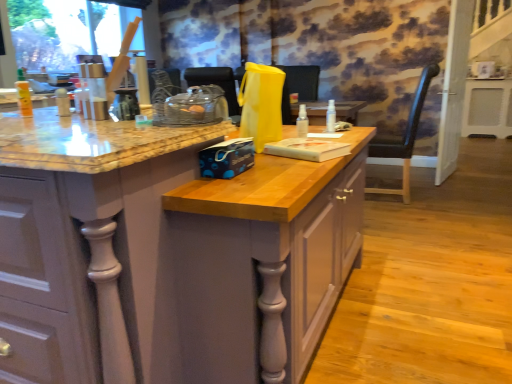
Question: From a real-world perspective, is white glossy screen door at right positioned under black leather chair at right based on gravity?

Choices:
 (A) no
 (B) yes

Answer: (A)

Question: Is white glossy screen door at right in contact with black leather chair at right?

Choices:
 (A) yes
 (B) no

Answer: (B)

Question: Is white glossy screen door at right outside of black leather chair at right?

Choices:
 (A) no
 (B) yes

Answer: (B)

Question: From a real-world perspective, is white glossy screen door at right on top of black leather chair at right?

Choices:
 (A) yes
 (B) no

Answer: (A)

Question: Does white glossy screen door at right appear on the left side of black leather chair at right?

Choices:
 (A) no
 (B) yes

Answer: (A)

Question: Considering the positions of transparent plastic spray bottle at center, positioned as the first bottle in back-to-front order, and black leather chair at right in the image, is transparent plastic spray bottle at center, positioned as the first bottle in back-to-front order, wider or thinner than black leather chair at right?

Choices:
 (A) wide
 (B) thin

Answer: (B)

Question: Considering the positions of transparent plastic spray bottle at center, which appears as the second bottle when viewed from the front, and black leather chair at right in the image, is transparent plastic spray bottle at center, which appears as the second bottle when viewed from the front, bigger or smaller than black leather chair at right?

Choices:
 (A) small
 (B) big

Answer: (A)

Question: In terms of height, does transparent plastic spray bottle at center, arranged as the second bottle when viewed from the left, look taller or shorter compared to black leather chair at right?

Choices:
 (A) short
 (B) tall

Answer: (A)

Question: From a real-world perspective, is transparent plastic spray bottle at center, arranged as the second bottle when viewed from the left, above or below black leather chair at right?

Choices:
 (A) above
 (B) below

Answer: (A)

Question: Considering the positions of transparent plastic spray bottle at center, which appears as the second bottle when viewed from the front, and matte wood cabinet at center in the image, is transparent plastic spray bottle at center, which appears as the second bottle when viewed from the front, bigger or smaller than matte wood cabinet at center?

Choices:
 (A) small
 (B) big

Answer: (A)

Question: Is transparent plastic spray bottle at center, the 1th bottle positioned from the right, in front of or behind matte wood cabinet at center in the image?

Choices:
 (A) front
 (B) behind

Answer: (B)

Question: From a real-world perspective, relative to matte wood cabinet at center, is transparent plastic spray bottle at center, the 1th bottle positioned from the right, vertically above or below?

Choices:
 (A) below
 (B) above

Answer: (B)

Question: Considering the positions of point (327, 127) and point (36, 230), is point (327, 127) closer or farther from the camera than point (36, 230)?

Choices:
 (A) closer
 (B) farther

Answer: (B)

Question: Looking at the image, does black leather chair at right seem bigger or smaller compared to matte wood cabinet at center?

Choices:
 (A) small
 (B) big

Answer: (A)

Question: In the image, is black leather chair at right on the left side or the right side of matte wood cabinet at center?

Choices:
 (A) right
 (B) left

Answer: (A)